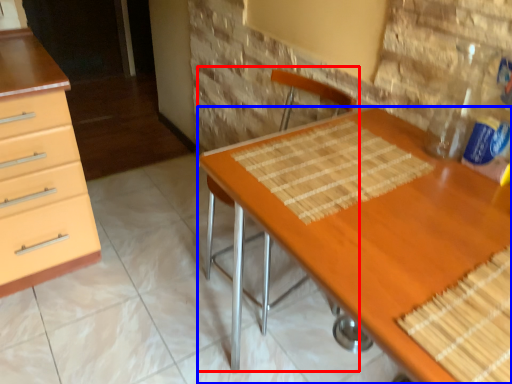
Question: Which point is closer to the camera, armchair (highlighted by a red box) or desk (highlighted by a blue box)?

Choices:
 (A) armchair
 (B) desk

Answer: (B)